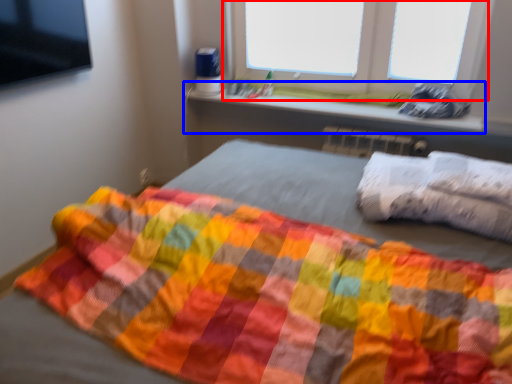
Question: Among these objects, which one is farthest to the camera, window (highlighted by a red box) or window sill (highlighted by a blue box)?

Choices:
 (A) window
 (B) window sill

Answer: (B)